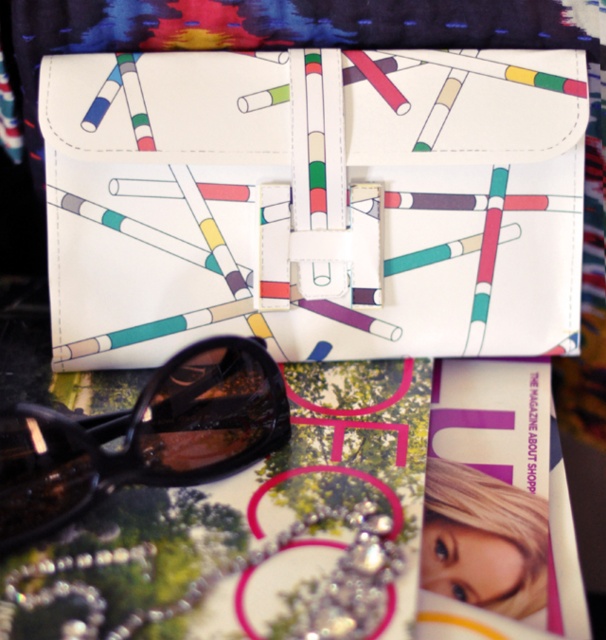
Question: Which point appears farthest from the camera in this image?

Choices:
 (A) (393, 305)
 (B) (92, 481)

Answer: (A)

Question: Is white leather clutch at center closer to camera compared to black shiny goggles at lower left?

Choices:
 (A) yes
 (B) no

Answer: (B)

Question: Which of the following is the closest to the observer?

Choices:
 (A) (485, 182)
 (B) (231, 339)

Answer: (B)

Question: Is white leather clutch at center below black shiny goggles at lower left?

Choices:
 (A) yes
 (B) no

Answer: (B)

Question: Does white leather clutch at center appear under black shiny goggles at lower left?

Choices:
 (A) yes
 (B) no

Answer: (B)